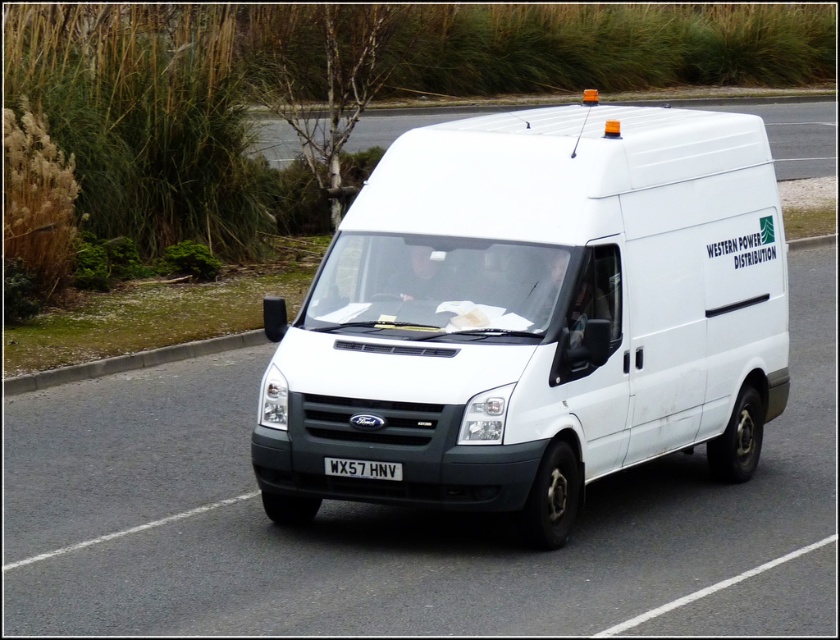
Is the position of white plastic van at center less distant than that of black plastic license plate at center?

No, it is not.

Is white plastic van at center smaller than black plastic license plate at center?

Actually, white plastic van at center might be larger than black plastic license plate at center.

Find the location of `white plastic van at center`. white plastic van at center is located at coordinates (790, 131).

Which is behind, point (366, 440) or point (819, 115)?

Point (819, 115)

Is point (634, 230) less distant than point (702, 108)?

Yes, point (634, 230) is in front of point (702, 108).

Identify the location of white matte van at center. The image size is (840, 640). (534, 316).

Between white matte van at center and black plastic license plate at center, which one appears on the left side from the viewer's perspective?

black plastic license plate at center is more to the left.

Can you confirm if white matte van at center is shorter than black plastic license plate at center?

No, white matte van at center is not shorter than black plastic license plate at center.

Is point (292, 376) positioned after point (400, 464)?

Yes, it is behind point (400, 464).

Identify the location of white matte van at center. This screenshot has height=640, width=840. (534, 316).